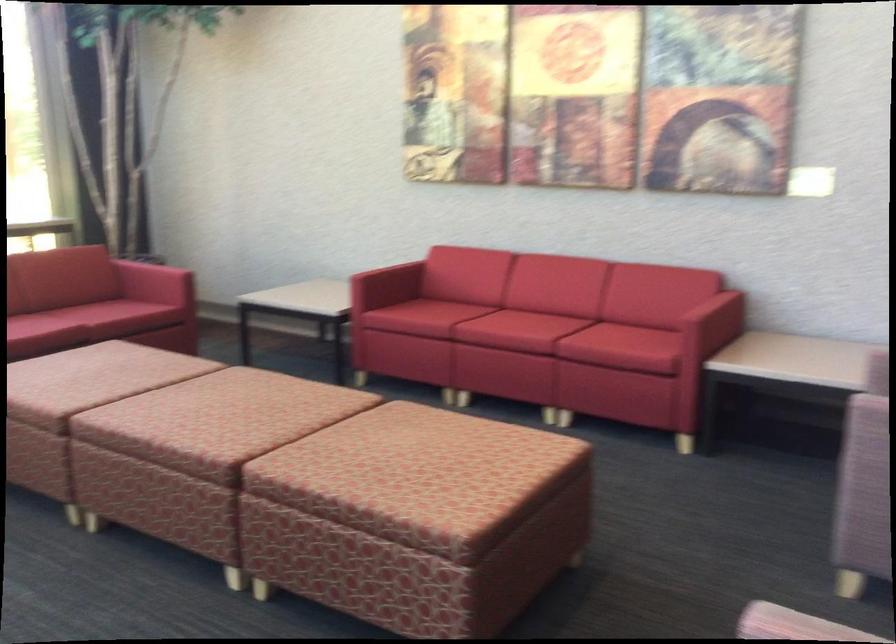
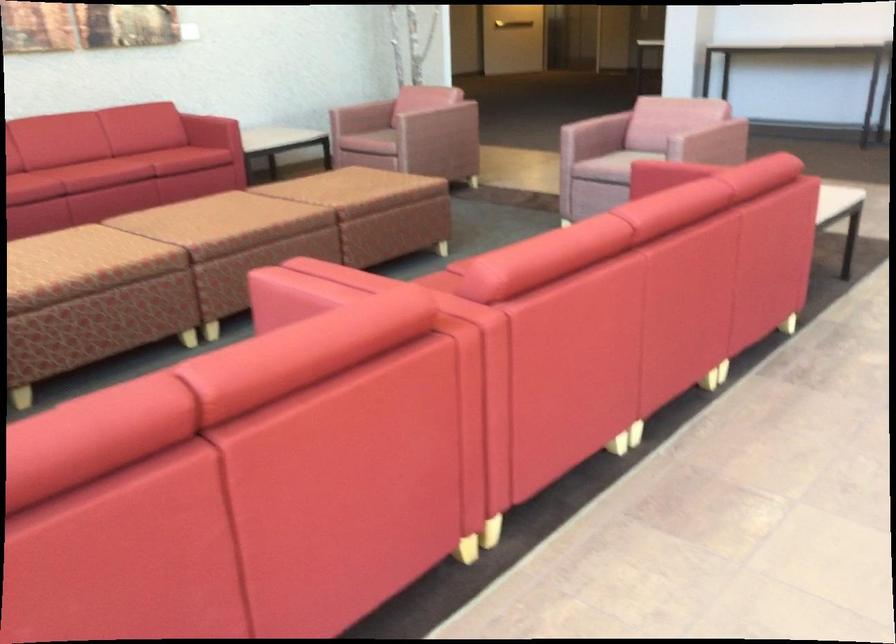
The point at (117, 433) is marked in the first image. Where is the corresponding point in the second image?

(254, 234)